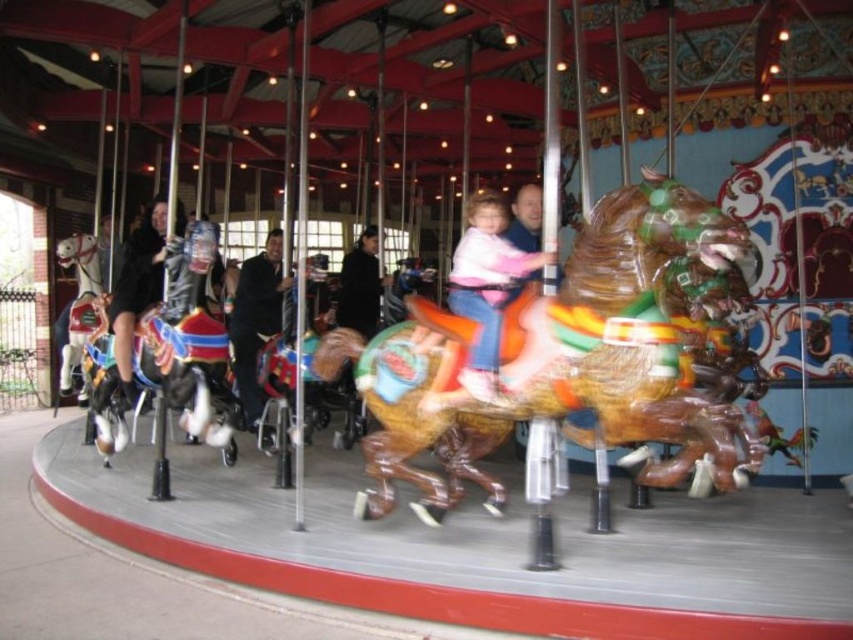
Question: Which of these objects is positioned farthest from the pink matte jacket at center?

Choices:
 (A) white glossy horse at left
 (B) shiny brown horse at center

Answer: (A)

Question: Is shiny brown horse at center in front of pink matte jacket at center?

Choices:
 (A) no
 (B) yes

Answer: (B)

Question: Which object is the closest to the shiny brown horse at center?

Choices:
 (A) pink matte jacket at center
 (B) white glossy horse at left

Answer: (A)

Question: Does shiny brown horse at center have a greater width compared to pink matte jacket at center?

Choices:
 (A) yes
 (B) no

Answer: (A)

Question: Which point is closer to the camera taking this photo?

Choices:
 (A) (65, 330)
 (B) (490, 262)

Answer: (B)

Question: Can you confirm if shiny brown horse at center is smaller than white glossy horse at left?

Choices:
 (A) no
 (B) yes

Answer: (A)